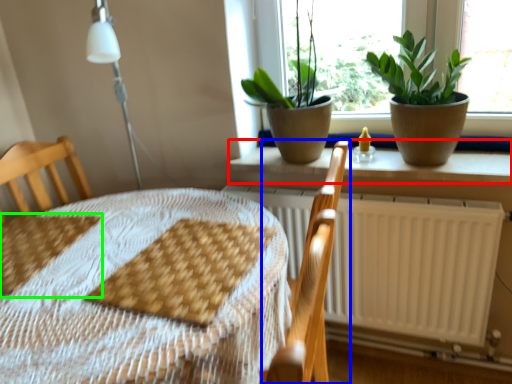
Question: Which object is the closest to the window sill (highlighted by a red box)? Choose among these: armchair (highlighted by a blue box) or sheet (highlighted by a green box).

Choices:
 (A) armchair
 (B) sheet

Answer: (A)